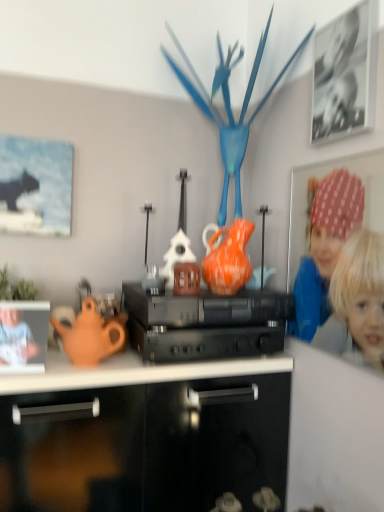
Question: Can you confirm if black plastic stereo at center is wider than black matte picture frame at upper right, which appears as the 1th picture frame when viewed from the front?

Choices:
 (A) no
 (B) yes

Answer: (B)

Question: Is black plastic stereo at center looking in the opposite direction of black matte picture frame at upper right, the 2th picture frame in the bottom-to-top sequence?

Choices:
 (A) no
 (B) yes

Answer: (A)

Question: From the image's perspective, is black plastic stereo at center on black matte picture frame at upper right, which is the 2th picture frame from left to right?

Choices:
 (A) no
 (B) yes

Answer: (A)

Question: Is black plastic stereo at center not near black matte picture frame at upper right, marked as the second picture frame in a back-to-front arrangement?

Choices:
 (A) yes
 (B) no

Answer: (B)

Question: Considering the relative sizes of black plastic stereo at center and black matte picture frame at upper right, the 2th picture frame in the bottom-to-top sequence, in the image provided, is black plastic stereo at center smaller than black matte picture frame at upper right, the 2th picture frame in the bottom-to-top sequence,?

Choices:
 (A) yes
 (B) no

Answer: (B)

Question: Is matte black cat at upper left, marked as the 1th picture frame in a left-to-right arrangement, inside or outside of matte orange teapot at left, positioned as the second person in right-to-left order?

Choices:
 (A) inside
 (B) outside

Answer: (B)

Question: From a real-world perspective, is matte black cat at upper left, marked as the 1th picture frame in a left-to-right arrangement, physically located above or below matte orange teapot at left, positioned as the second person in right-to-left order?

Choices:
 (A) below
 (B) above

Answer: (B)

Question: Considering the positions of matte black cat at upper left, which ranks as the 1th picture frame in bottom-to-top order, and matte orange teapot at left, the 1th person positioned from the left, in the image, is matte black cat at upper left, which ranks as the 1th picture frame in bottom-to-top order, bigger or smaller than matte orange teapot at left, the 1th person positioned from the left,?

Choices:
 (A) small
 (B) big

Answer: (B)

Question: Relative to matte orange teapot at left, the 1th person positioned from the left, is matte black cat at upper left, which ranks as the 1th picture frame in bottom-to-top order, in front or behind?

Choices:
 (A) behind
 (B) front

Answer: (A)

Question: Considering the positions of point (170, 32) and point (54, 200), is point (170, 32) closer or farther from the camera than point (54, 200)?

Choices:
 (A) farther
 (B) closer

Answer: (A)

Question: Considering the positions of blue glossy bird at center and matte black cat at upper left, which is counted as the 2th picture frame, starting from the right, in the image, is blue glossy bird at center bigger or smaller than matte black cat at upper left, which is counted as the 2th picture frame, starting from the right,?

Choices:
 (A) big
 (B) small

Answer: (A)

Question: Is blue glossy bird at center situated inside matte black cat at upper left, which is counted as the 2th picture frame, starting from the front, or outside?

Choices:
 (A) outside
 (B) inside

Answer: (A)

Question: From a real-world perspective, relative to matte black cat at upper left, which is counted as the 1th picture frame, starting from the back, is blue glossy bird at center vertically above or below?

Choices:
 (A) above
 (B) below

Answer: (A)

Question: From a real-world perspective, is black plastic stereo at center above or below orange glazed earthenware teapot at center?

Choices:
 (A) below
 (B) above

Answer: (A)

Question: Considering the positions of point (147, 325) and point (240, 262), is point (147, 325) closer or farther from the camera than point (240, 262)?

Choices:
 (A) farther
 (B) closer

Answer: (B)